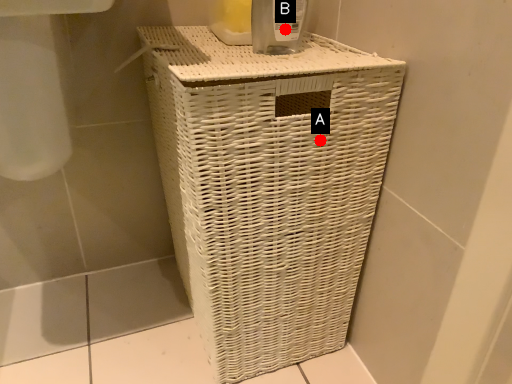
Question: Two points are circled on the image, labeled by A and B beside each circle. Which point is closer to the camera taking this photo?

Choices:
 (A) A is closer
 (B) B is closer

Answer: (A)